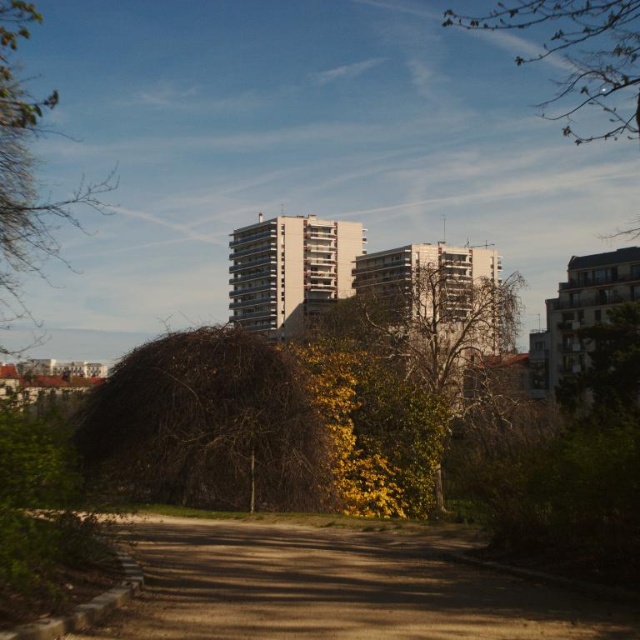
Question: Is brown textured tree at center smaller than brown textured bush at left?

Choices:
 (A) no
 (B) yes

Answer: (B)

Question: Is brown dirt path at lower center above brown textured bush at left?

Choices:
 (A) no
 (B) yes

Answer: (A)

Question: Which point is closer to the camera?

Choices:
 (A) (3, 40)
 (B) (312, 497)
 (C) (497, 616)

Answer: (C)

Question: Which object is the farthest from the brown textured tree at center?

Choices:
 (A) brown textured bush at left
 (B) brown dirt path at lower center

Answer: (A)

Question: Which of the following is the farthest from the observer?

Choices:
 (A) brown textured bush at left
 (B) brown dirt path at lower center
 (C) brown textured tree at center

Answer: (A)

Question: Can you confirm if brown dirt path at lower center is smaller than brown textured bush at left?

Choices:
 (A) yes
 (B) no

Answer: (A)